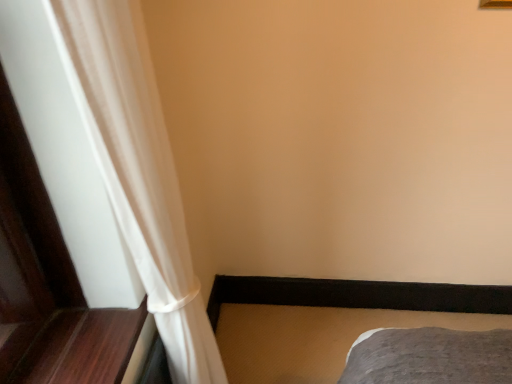
In order to face white sheer curtain at left, should I rotate leftwards or rightwards?

You should rotate left by 8.904 degrees.

What do you see at coordinates (110, 162) in the screenshot?
I see `white sheer curtain at left` at bounding box center [110, 162].

The width and height of the screenshot is (512, 384). Find the location of `white sheer curtain at left`. white sheer curtain at left is located at coordinates (110, 162).

Measure the distance between point [321,320] and camera.

Point [321,320] is 6.33 feet from camera.

I want to click on gray fabric bed frame at lower right, so click(x=331, y=320).

The width and height of the screenshot is (512, 384). What do you see at coordinates (331, 320) in the screenshot? I see `gray fabric bed frame at lower right` at bounding box center [331, 320].

Identify the location of white sheer curtain at left. The height and width of the screenshot is (384, 512). (110, 162).

Can you confirm if gray fabric bed frame at lower right is positioned to the right of white sheer curtain at left?

Yes, gray fabric bed frame at lower right is to the right of white sheer curtain at left.

Who is more distant, gray fabric bed frame at lower right or white sheer curtain at left?

gray fabric bed frame at lower right is further from the camera.

Is point (291, 311) closer or farther from the camera than point (133, 31)?

Point (291, 311).

From the image's perspective, which object appears higher, gray fabric bed frame at lower right or white sheer curtain at left?

white sheer curtain at left, from the image's perspective.

From a real-world perspective, is gray fabric bed frame at lower right positioned above or below white sheer curtain at left?

Clearly, from a real-world perspective, gray fabric bed frame at lower right is below white sheer curtain at left.

Which object is thinner, gray fabric bed frame at lower right or white sheer curtain at left?

With smaller width is white sheer curtain at left.

Considering the sizes of objects gray fabric bed frame at lower right and white sheer curtain at left in the image provided, who is taller, gray fabric bed frame at lower right or white sheer curtain at left?

white sheer curtain at left.

In the scene shown: Looking at the image, does gray fabric bed frame at lower right seem bigger or smaller compared to white sheer curtain at left?

gray fabric bed frame at lower right is smaller than white sheer curtain at left.

Is gray fabric bed frame at lower right spatially inside white sheer curtain at left, or outside of it?

gray fabric bed frame at lower right is not enclosed by white sheer curtain at left.

Is gray fabric bed frame at lower right directly adjacent to white sheer curtain at left?

There is a gap between gray fabric bed frame at lower right and white sheer curtain at left.

Is gray fabric bed frame at lower right positioned with its back to white sheer curtain at left?

No, gray fabric bed frame at lower right is not facing the opposite direction of white sheer curtain at left.

How different are the orientations of gray fabric bed frame at lower right and white sheer curtain at left in degrees?

They differ by 89.2 degrees in their facing directions.

Measure the distance from gray fabric bed frame at lower right to white sheer curtain at left.

gray fabric bed frame at lower right and white sheer curtain at left are 3.30 feet apart from each other.

The height and width of the screenshot is (384, 512). I want to click on curtain above the gray fabric bed frame at lower right (from the image's perspective), so click(110, 162).

Is white sheer curtain at left to the left or to the right of gray fabric bed frame at lower right in the image?

white sheer curtain at left is positioned on gray fabric bed frame at lower right's left side.

Considering their positions, is white sheer curtain at left located in front of or behind gray fabric bed frame at lower right?

In the image, white sheer curtain at left appears in front of gray fabric bed frame at lower right.

Is point (95, 259) positioned after point (389, 303)?

That is False.

In the scene shown: From the image's perspective, would you say white sheer curtain at left is shown under gray fabric bed frame at lower right?

No, from the image's perspective, white sheer curtain at left is not beneath gray fabric bed frame at lower right.

From a real-world perspective, relative to gray fabric bed frame at lower right, is white sheer curtain at left vertically above or below?

Clearly, from a real-world perspective, white sheer curtain at left is above gray fabric bed frame at lower right.

From the picture: Which object is wider, white sheer curtain at left or gray fabric bed frame at lower right?

gray fabric bed frame at lower right is wider.

From the picture: Between white sheer curtain at left and gray fabric bed frame at lower right, which one has more height?

white sheer curtain at left is taller.

Can you confirm if white sheer curtain at left is bigger than gray fabric bed frame at lower right?

Correct, white sheer curtain at left is larger in size than gray fabric bed frame at lower right.

Is white sheer curtain at left surrounding gray fabric bed frame at lower right?

No, gray fabric bed frame at lower right is located outside of white sheer curtain at left.

Is white sheer curtain at left beside gray fabric bed frame at lower right?

No, white sheer curtain at left is not in contact with gray fabric bed frame at lower right.

Is white sheer curtain at left oriented towards gray fabric bed frame at lower right?

No, white sheer curtain at left is not aimed at gray fabric bed frame at lower right.

Can you tell me how much white sheer curtain at left and gray fabric bed frame at lower right differ in facing direction?

89.2 degrees separate the facing orientations of white sheer curtain at left and gray fabric bed frame at lower right.

Where is `bed frame lying on the right of white sheer curtain at left`? bed frame lying on the right of white sheer curtain at left is located at coordinates (331, 320).

Locate an element on the screen. bed frame behind the white sheer curtain at left is located at coordinates (331, 320).

Identify the location of curtain in front of the gray fabric bed frame at lower right. Image resolution: width=512 pixels, height=384 pixels. (110, 162).